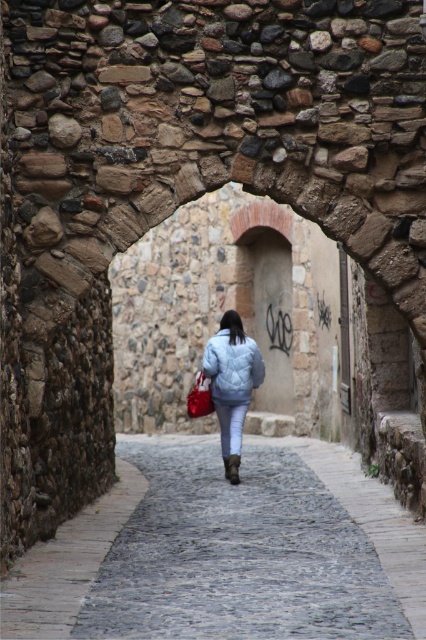
You are a delivery robot with a 1.5 meter wide package. You need to pass through the narrow cobblestone alleyway while avoiding the light blue quilted jacket at center and the matte red shopping bag at center. Can you fit through the space between them?

The light blue quilted jacket at center and the matte red shopping bag at center are 1.48 meters apart. Since your package is 1.5 meters wide, which is slightly wider than the gap, you cannot fit through the space between them.

You are a delivery robot navigating the narrow cobblestone alleyway. You need to pass by the person walking towards the end of the alley. The cobblestone path at center is your route. Can you safely maneuver around the matte red shopping bag at center without going off the path?

The cobblestone path at center might be wider than matte red shopping bag at center, so there is a possibility that the delivery robot can safely maneuver around the matte red shopping bag at center while staying on the path.